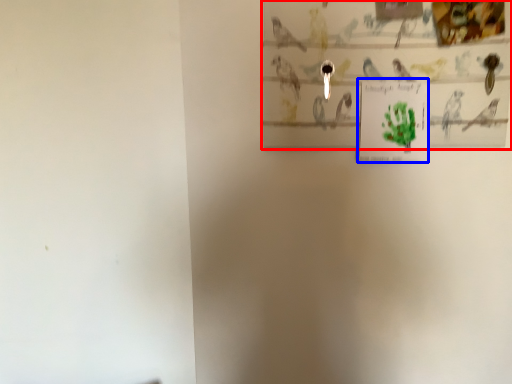
Question: Which point is further to the camera, picture frame (highlighted by a red box) or postcard (highlighted by a blue box)?

Choices:
 (A) picture frame
 (B) postcard

Answer: (B)